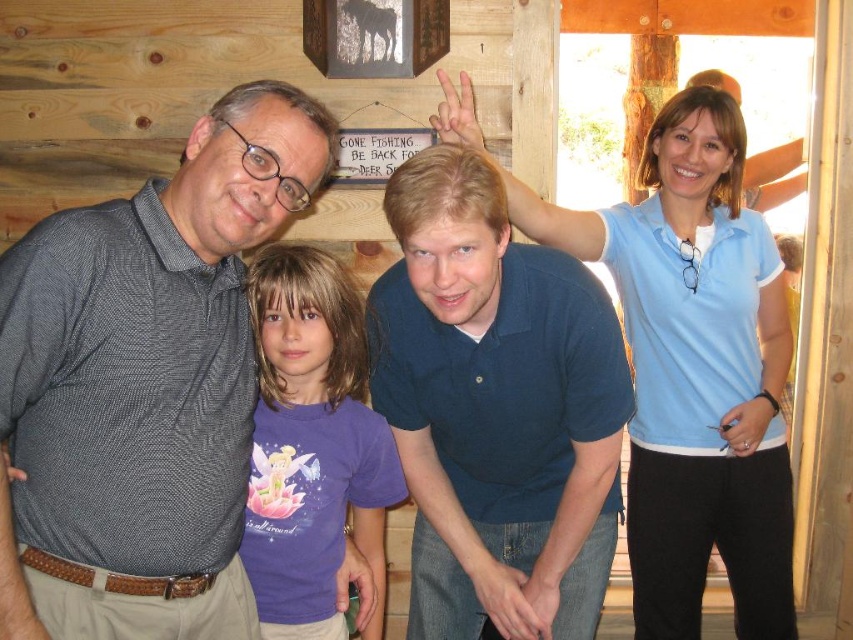
You are a photographer setting up for a group photo. You have two subjects wearing the matte gray shirt at left and the purple cotton shirt at center. The distance between them is crucial for your shot. If your camera can focus on objects within a 25 cm range, will you need to adjust their positions?

The matte gray shirt at left is 26.35 centimeters from the purple cotton shirt at center. Since the camera can only focus within 25 cm, you will need to adjust their positions to be closer.

You are a photographer taking a group photo of the scene described. You want to ensure that the dark blue polo shirt at center and the purple cotton shirt at center are clearly visible in the final shot. Given their distance apart, is there enough space between them for the camera to focus on both shirts individually?

The dark blue polo shirt at center is 21.80 centimeters away from the purple cotton shirt at center. This distance allows the camera to focus on both shirts individually as they are sufficiently spaced apart.